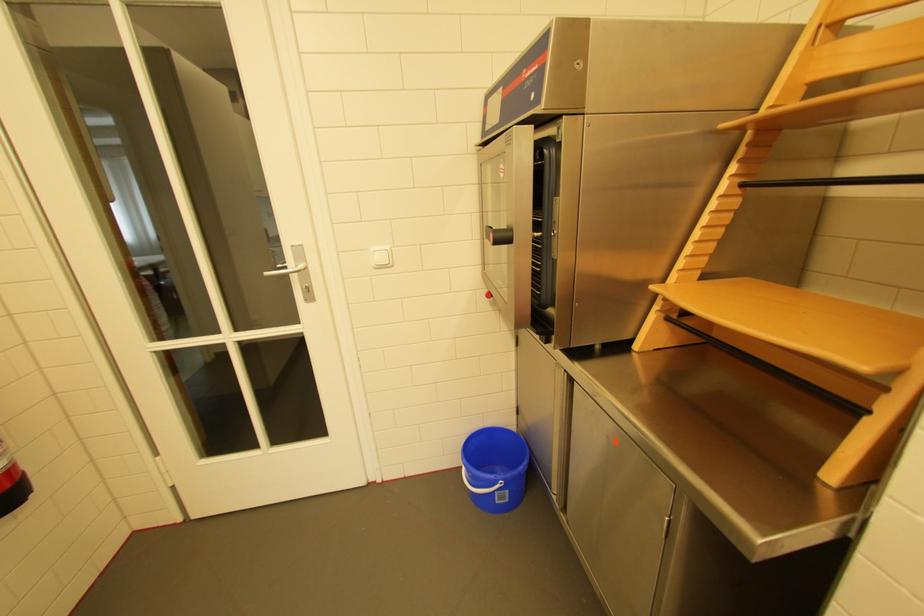
The width and height of the screenshot is (924, 616). Identify the location of silver door handle. (289, 269).